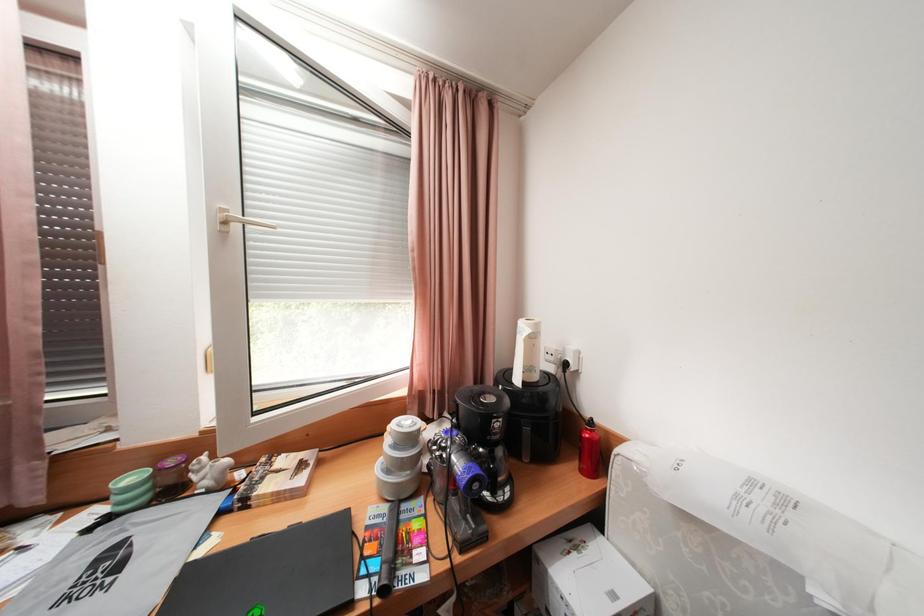
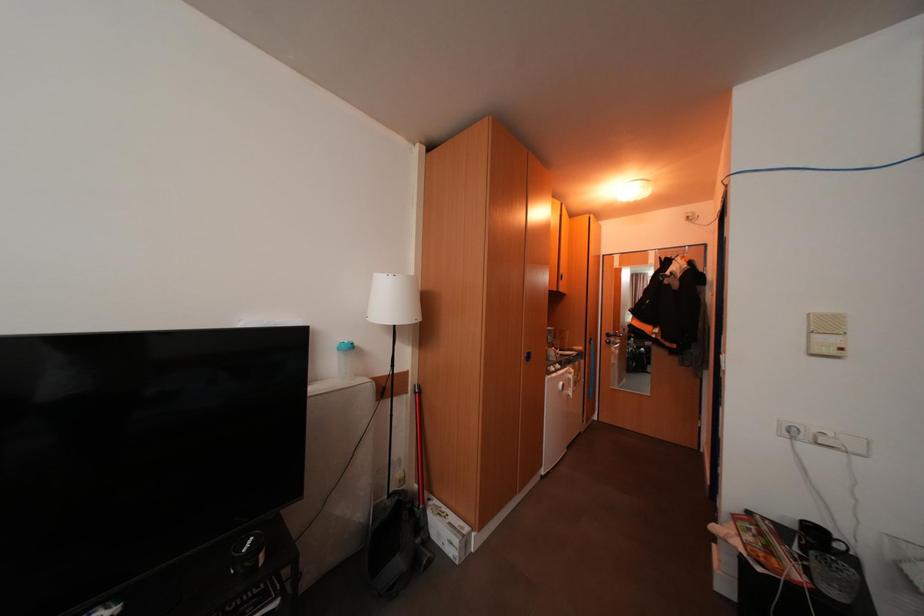
Question: The images are taken continuously from a first-person perspective. In which direction is your viewpoint rotating?

Choices:
 (A) Left
 (B) Right
 (C) Up
 (D) Down

Answer: (B)